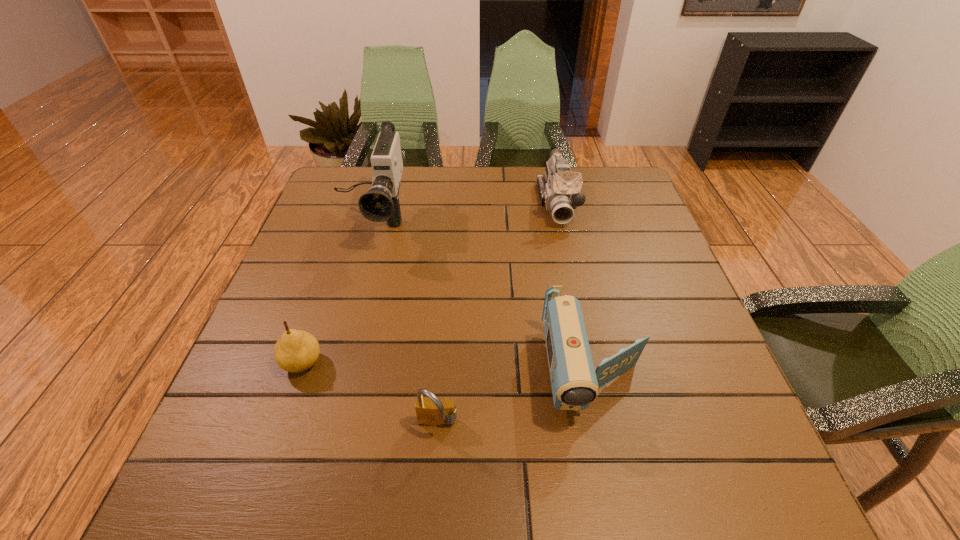
Locate an element on the screen. The height and width of the screenshot is (540, 960). pear that is at the left edge is located at coordinates (296, 351).

At what (x,y) coordinates should I click in order to perform the action: click on object that is at the right edge. Please return your answer as a coordinate pair (x, y). The image size is (960, 540). Looking at the image, I should click on (575, 383).

Where is `object that is at the far left corner`? object that is at the far left corner is located at coordinates (381, 203).

Find the location of a particular element. Image resolution: width=960 pixels, height=540 pixels. vacant area at the far edge is located at coordinates (500, 176).

Where is `free space at the near edge of the desktop`? free space at the near edge of the desktop is located at coordinates (580, 478).

Identify the location of vacant space at the left edge of the desktop. The image size is (960, 540). (270, 401).

At what (x,y) coordinates should I click in order to perform the action: click on vacant space at the right edge of the desktop. Please return your answer as a coordinate pair (x, y). The width and height of the screenshot is (960, 540). Looking at the image, I should click on (606, 252).

At what (x,y) coordinates should I click in order to perform the action: click on vacant space at the near left corner. Please return your answer as a coordinate pair (x, y). The width and height of the screenshot is (960, 540). Looking at the image, I should click on (224, 469).

Locate an element on the screen. The height and width of the screenshot is (540, 960). vacant space at the far right corner of the desktop is located at coordinates (612, 170).

Where is `vacant region between the tallest object and the shortest camcorder`? vacant region between the tallest object and the shortest camcorder is located at coordinates (482, 298).